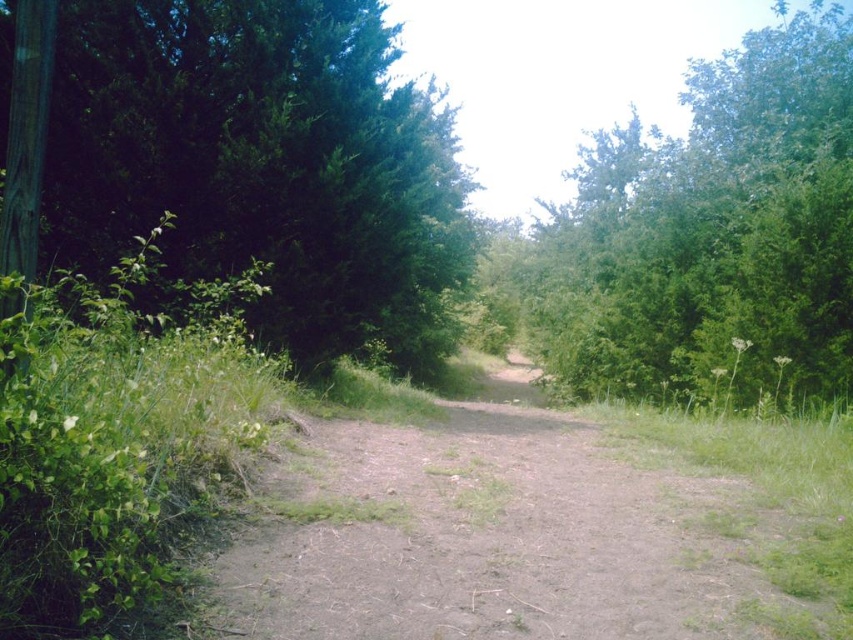
Which of these two, brown dirt track at center or green leafy tree at upper right, stands shorter?

With less height is brown dirt track at center.

Is brown dirt track at center further to the viewer compared to green leafy tree at upper right?

Yes, it is behind green leafy tree at upper right.

Is point (746, 525) positioned after point (799, 148)?

That is False.

Identify the location of brown dirt track at center. The height and width of the screenshot is (640, 853). (492, 536).

What do you see at coordinates (264, 164) in the screenshot? This screenshot has height=640, width=853. I see `green leafy tree at left` at bounding box center [264, 164].

Does green leafy tree at left appear under green leafy tree at upper right?

Indeed, green leafy tree at left is positioned under green leafy tree at upper right.

Between point (173, 184) and point (730, 170), which one is positioned in front?

Positioned in front is point (173, 184).

In order to click on green leafy tree at left in this screenshot , I will do `click(264, 164)`.

Can you confirm if green leafy tree at left is shorter than brown dirt track at center?

Incorrect, green leafy tree at left's height does not fall short of brown dirt track at center's.

Between point (308, 33) and point (515, 381), which one is positioned behind?

Point (515, 381)

Which is in front, point (379, 284) or point (637, 592)?

Point (637, 592) is more forward.

Identify the location of green leafy tree at left. (264, 164).